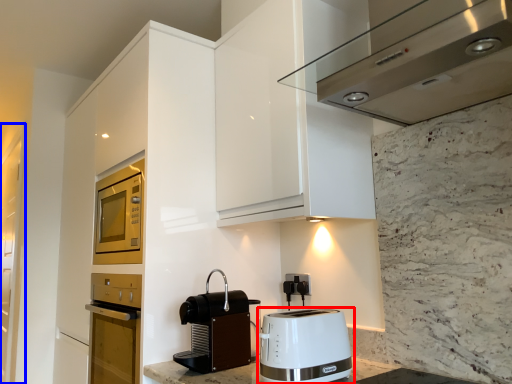
Question: Which of the following is the closest to the observer, toaster (highlighted by a red box) or glass door (highlighted by a blue box)?

Choices:
 (A) toaster
 (B) glass door

Answer: (A)